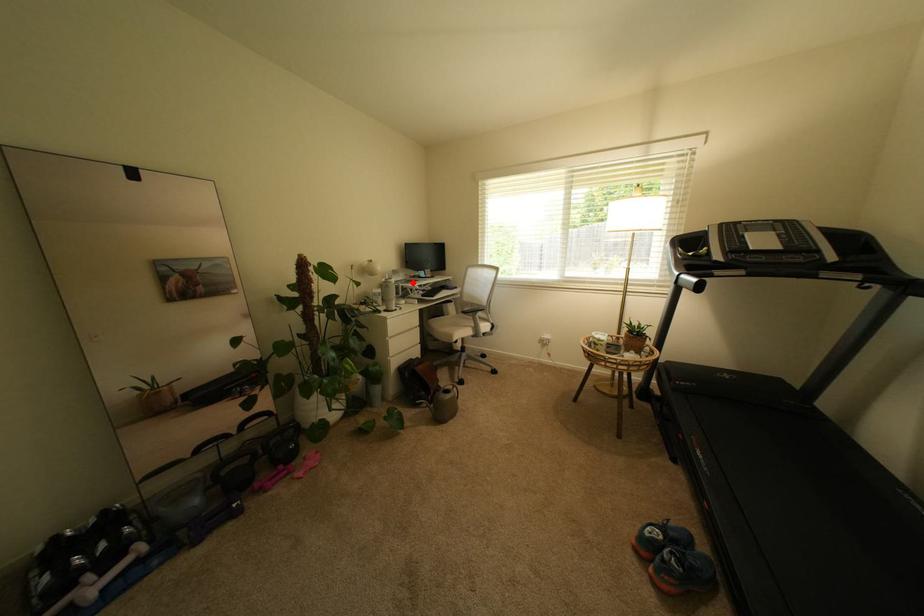
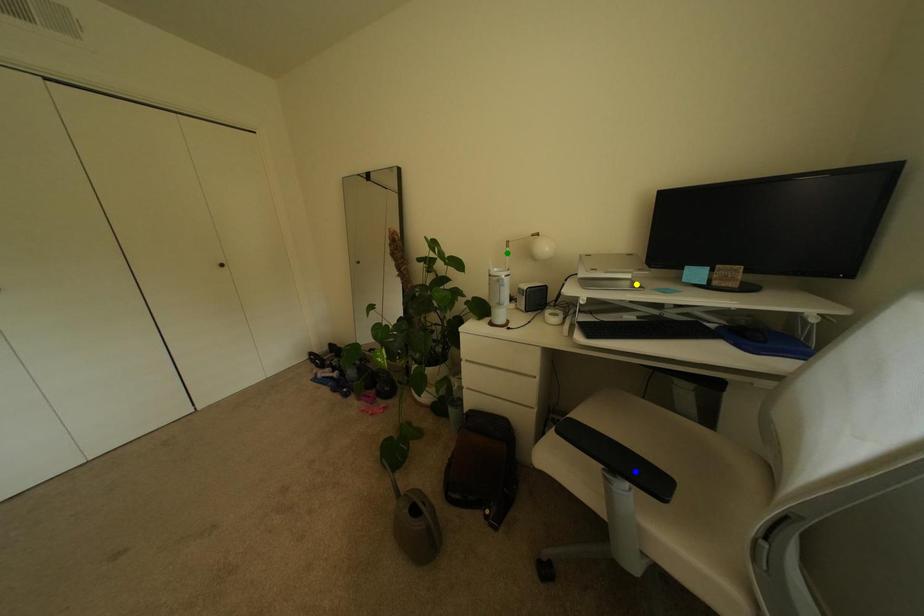
Question: I am providing you with two images of the same scene from different viewpoints. A red point is marked on the first image. You are given multiple points on the second image. Which point in image 2 is actually the same real-world point as the red point in image 1?

Choices:
 (A) green point
 (B) blue point
 (C) yellow point

Answer: (C)